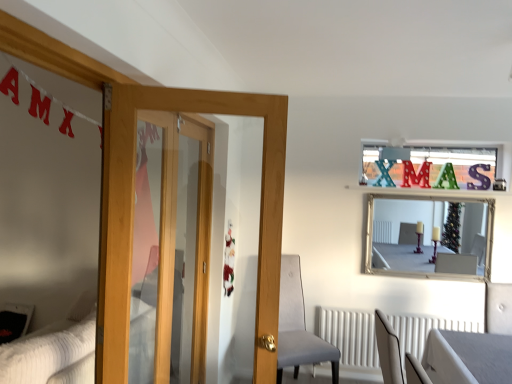
Question: From the image's perspective, is white textured radiator at lower center located above metallic silver letter at upper right, the 2th letter viewed from the left?

Choices:
 (A) no
 (B) yes

Answer: (A)

Question: Would you say metallic silver letter at upper right, which appears as the 1th letter when viewed from the right, is part of white textured radiator at lower center's contents?

Choices:
 (A) yes
 (B) no

Answer: (B)

Question: Is white textured radiator at lower center not close to metallic silver letter at upper right, the 2th letter viewed from the left?

Choices:
 (A) no
 (B) yes

Answer: (B)

Question: Is white textured radiator at lower center at the right side of metallic silver letter at upper right, which appears as the 1th letter when viewed from the right?

Choices:
 (A) no
 (B) yes

Answer: (A)

Question: Can you confirm if white textured radiator at lower center is wider than metallic silver letter at upper right, the 2th letter viewed from the left?

Choices:
 (A) no
 (B) yes

Answer: (B)

Question: Is white textured radiator at lower center outside metallic silver letter at upper right, which appears as the 1th letter when viewed from the right?

Choices:
 (A) yes
 (B) no

Answer: (A)

Question: Does metallic silver letter at upper right, which appears as the 1th letter when viewed from the right, have a smaller size compared to white textured bed at lower left?

Choices:
 (A) no
 (B) yes

Answer: (B)

Question: From a real-world perspective, does metallic silver letter at upper right, the 2th letter viewed from the left, stand above white textured bed at lower left?

Choices:
 (A) no
 (B) yes

Answer: (B)

Question: Does metallic silver letter at upper right, which appears as the 1th letter when viewed from the right, lie behind white textured bed at lower left?

Choices:
 (A) no
 (B) yes

Answer: (B)

Question: Does metallic silver letter at upper right, the 2th letter viewed from the left, have a lesser height compared to white textured bed at lower left?

Choices:
 (A) yes
 (B) no

Answer: (A)

Question: Is metallic silver letter at upper right, the 2th letter viewed from the left, not inside white textured bed at lower left?

Choices:
 (A) no
 (B) yes

Answer: (B)

Question: Is metallic silver letter at upper right, which appears as the 1th letter when viewed from the right, oriented towards white textured bed at lower left?

Choices:
 (A) yes
 (B) no

Answer: (B)

Question: From the image's perspective, is white textured radiator at lower center located above silver/glass mirror at upper center?

Choices:
 (A) yes
 (B) no

Answer: (B)